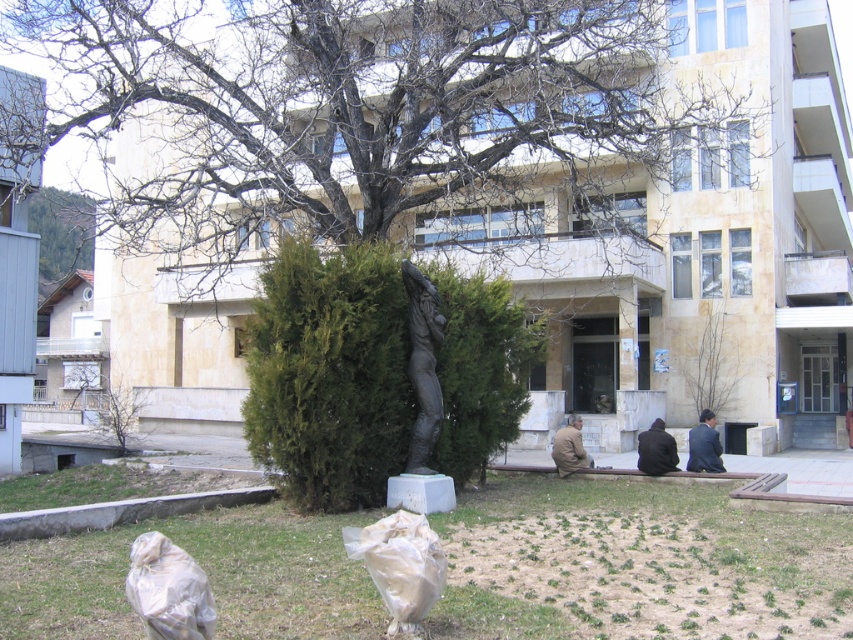
Question: Which point is farther to the camera?

Choices:
 (A) white plastic bag at lower center
 (B) green grass at lower center

Answer: (B)

Question: Is green leafy bush at center smaller than dark matte jacket at lower center?

Choices:
 (A) yes
 (B) no

Answer: (B)

Question: Which object appears closest to the camera in this image?

Choices:
 (A) bare branches at center
 (B) white plastic bag at lower center
 (C) green grass at lower center
 (D) green leafy bush at center

Answer: (B)

Question: Is green grass at lower center to the right of dark blue suit at lower right from the viewer's perspective?

Choices:
 (A) yes
 (B) no

Answer: (B)

Question: Is white plastic bag at lower center thinner than dark matte jacket at lower center?

Choices:
 (A) no
 (B) yes

Answer: (A)

Question: Estimate the real-world distances between objects in this image. Which object is closer to the black polished statue at center?

Choices:
 (A) dark matte jacket at lower center
 (B) transparent plastic bag at lower left
 (C) white plastic bag at lower center

Answer: (A)